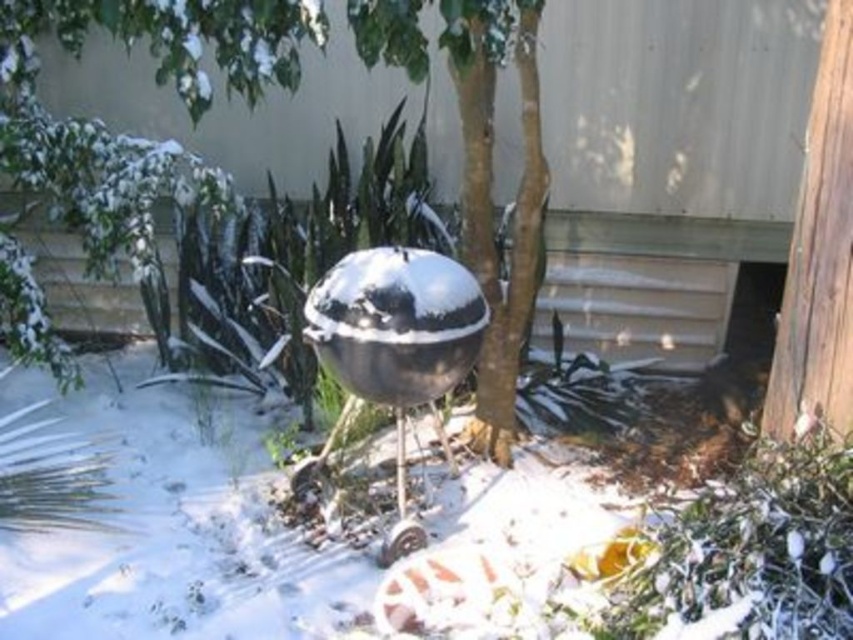
Question: Is green leafy tree at center bigger than shiny metallic sphere at center?

Choices:
 (A) no
 (B) yes

Answer: (B)

Question: Does green leafy tree at center appear under shiny metallic sphere at center?

Choices:
 (A) no
 (B) yes

Answer: (A)

Question: Can you confirm if green leafy tree at center is positioned below shiny metallic sphere at center?

Choices:
 (A) no
 (B) yes

Answer: (A)

Question: Which of the following is the closest to the observer?

Choices:
 (A) green leafy tree at center
 (B) shiny metallic sphere at center

Answer: (A)